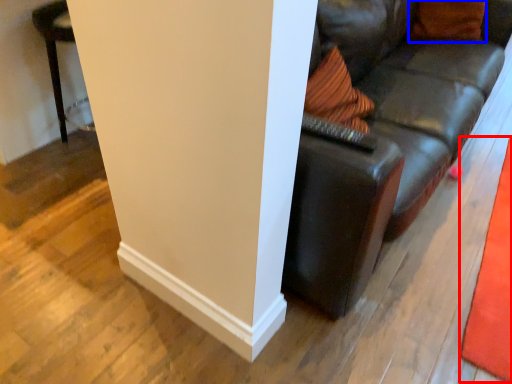
Question: Which point is further to the camera, mat (highlighted by a red box) or pillow (highlighted by a blue box)?

Choices:
 (A) mat
 (B) pillow

Answer: (B)